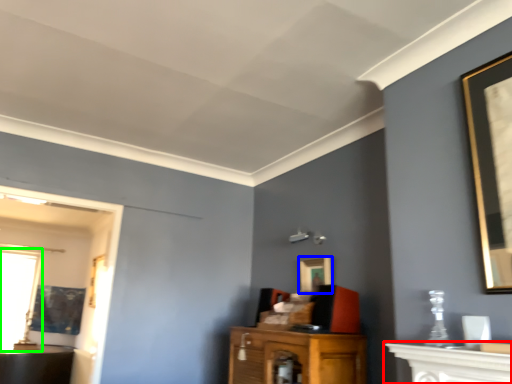
Question: Estimate the real-world distances between objects in this image. Which object is closer to vanity (highlighted by a red box), picture frame (highlighted by a blue box) or window (highlighted by a green box)?

Choices:
 (A) picture frame
 (B) window

Answer: (A)